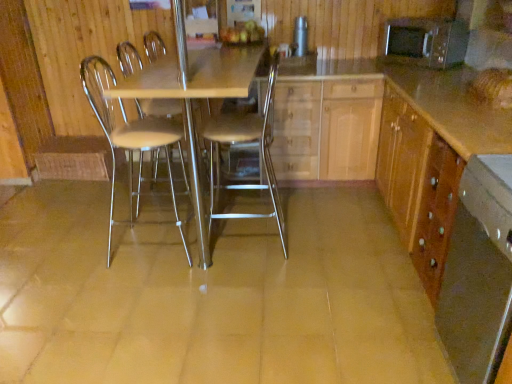
Where is `vacant point to the right of metallic cylindrical container at upper center, the second appliance in the right-to-left sequence`? vacant point to the right of metallic cylindrical container at upper center, the second appliance in the right-to-left sequence is located at coordinates (318, 60).